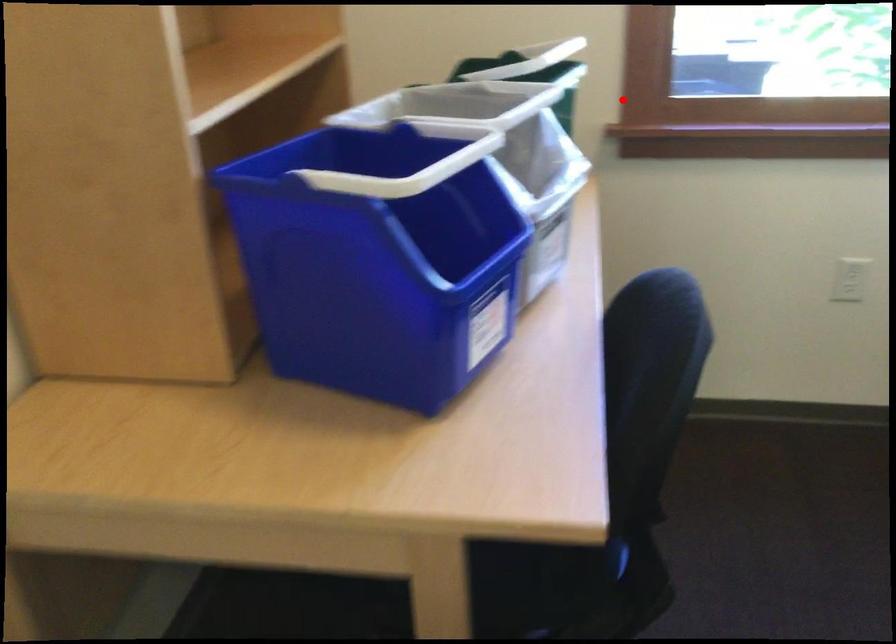
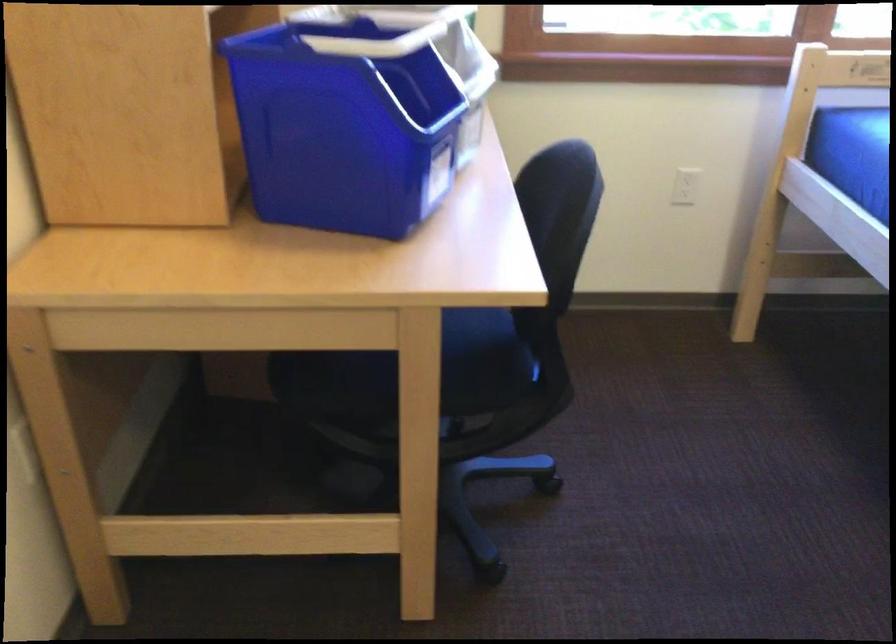
In the second image, find the point that corresponds to the highlighted location in the first image.

(506, 26)